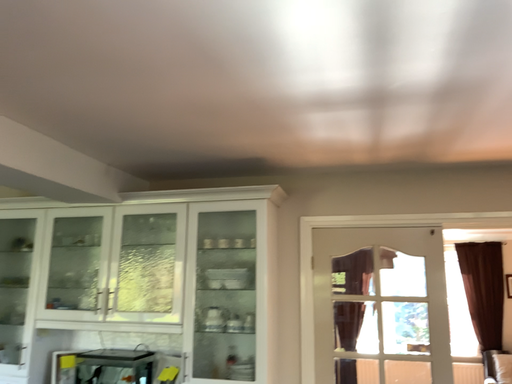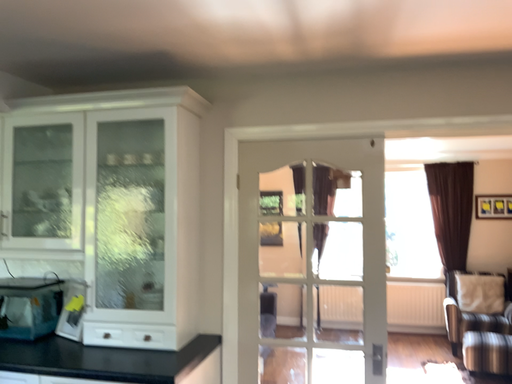
Question: Which way did the camera rotate in the video?

Choices:
 (A) rotated upward
 (B) rotated downward

Answer: (B)